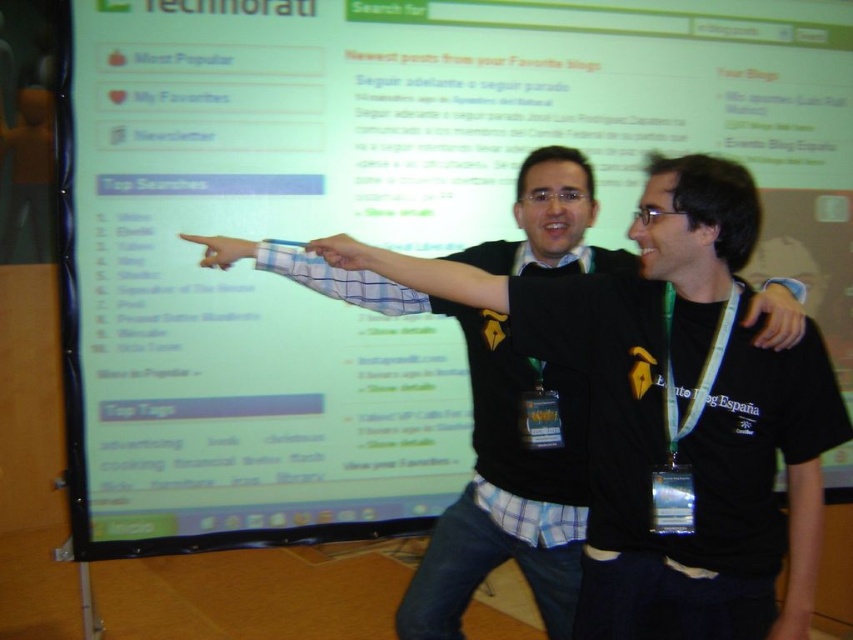
Question: Which point is farther to the camera?

Choices:
 (A) (256, 248)
 (B) (363, 252)

Answer: (A)

Question: Which of the following is the closest to the observer?

Choices:
 (A) matte black hand at upper right
 (B) matte blue pen at upper center
 (C) matte blue shirt at upper center

Answer: (A)

Question: Is matte black hand at upper right to the left of matte blue pen at upper center from the viewer's perspective?

Choices:
 (A) no
 (B) yes

Answer: (A)

Question: Can you confirm if matte black hand at upper right is bigger than matte blue shirt at upper center?

Choices:
 (A) no
 (B) yes

Answer: (B)

Question: Which is nearer to the matte blue pen at upper center?

Choices:
 (A) matte blue shirt at upper center
 (B) matte black hand at upper right

Answer: (A)

Question: Observing the image, what is the correct spatial positioning of matte black hand at upper right in reference to matte blue pen at upper center?

Choices:
 (A) left
 (B) right

Answer: (B)